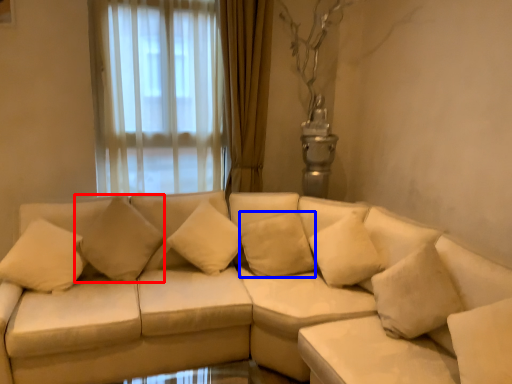
Question: Which of the following is the farthest to the observer, pillow (highlighted by a red box) or pillow (highlighted by a blue box)?

Choices:
 (A) pillow
 (B) pillow

Answer: (B)